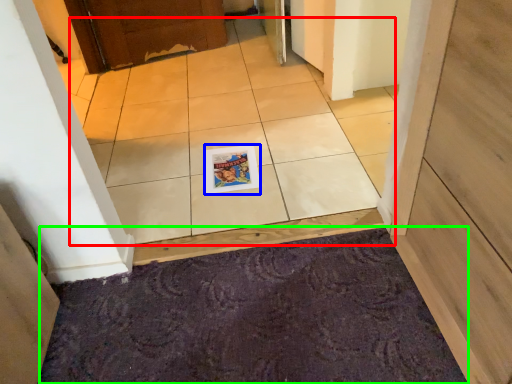
Question: Considering the real-world distances, which object is farthest from ceramic tile (highlighted by a red box)? magazine (highlighted by a blue box) or doormat (highlighted by a green box)?

Choices:
 (A) magazine
 (B) doormat

Answer: (B)